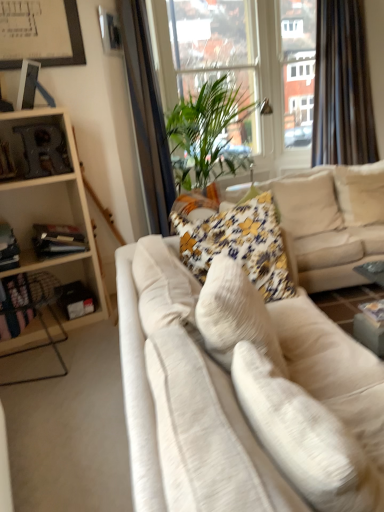
The width and height of the screenshot is (384, 512). I want to click on velvet beige couch at center, the second studio couch when ordered from front to back, so click(331, 222).

What do you see at coordinates (298, 69) in the screenshot?
I see `white plastic window frame at upper center` at bounding box center [298, 69].

Describe the element at coordinates (242, 393) in the screenshot. The height and width of the screenshot is (512, 384). I see `white fabric couch at center, the first studio couch viewed from the front` at that location.

The width and height of the screenshot is (384, 512). What are the coordinates of `transparent glass window screen at upper center` in the screenshot? It's located at (214, 44).

Describe the element at coordinates (342, 87) in the screenshot. I see `black velvet curtain at upper right` at that location.

Identify the location of green leafy plant at center. (211, 129).

Between floral fabric pillow at center, the 3th pillow in the front-to-back sequence, and velvet beige couch at center, the second studio couch when ordered from front to back, which one has more height?

velvet beige couch at center, the second studio couch when ordered from front to back.

Based on the photo, from a real-world perspective, which is physically below, floral fabric pillow at center, the 2th pillow when ordered from back to front, or velvet beige couch at center, the second studio couch when ordered from front to back?

velvet beige couch at center, the second studio couch when ordered from front to back, from a real-world perspective.

Is velvet beige couch at center, arranged as the first studio couch when viewed from the back, at the back of floral fabric pillow at center, the 3th pillow in the front-to-back sequence?

Yes, floral fabric pillow at center, the 3th pillow in the front-to-back sequence, is positioned with its back facing velvet beige couch at center, arranged as the first studio couch when viewed from the back.

Is floral fabric pillow at center, the 3th pillow in the front-to-back sequence, spatially inside velvet beige couch at center, arranged as the first studio couch when viewed from the back, or outside of it?

floral fabric pillow at center, the 3th pillow in the front-to-back sequence, is contained in velvet beige couch at center, arranged as the first studio couch when viewed from the back.

Would you say transparent glass window screen at upper center is part of white plastic window frame at upper center's contents?

No, transparent glass window screen at upper center is located outside of white plastic window frame at upper center.

Is point (301, 21) closer to viewer compared to point (243, 143)?

No, it is behind (243, 143).

Can you tell me how much white plastic window frame at upper center and transparent glass window screen at upper center differ in facing direction?

The facing directions of white plastic window frame at upper center and transparent glass window screen at upper center are 50.4 degrees apart.

Can you confirm if white plastic window frame at upper center is smaller than transparent glass window screen at upper center?

Yes, white plastic window frame at upper center is smaller than transparent glass window screen at upper center.

Is point (350, 508) behind point (236, 313)?

No, it is not.

From a real-world perspective, is white fabric pillow at center, which appears as the first pillow when viewed from the front, above or below white fabric couch at center, placed as the second studio couch when sorted from back to front?

white fabric pillow at center, which appears as the first pillow when viewed from the front, is above white fabric couch at center, placed as the second studio couch when sorted from back to front.

From the image's perspective, between white fabric pillow at center, which appears as the first pillow when viewed from the front, and white fabric couch at center, the first studio couch viewed from the front, which one is located above?

white fabric couch at center, the first studio couch viewed from the front, is shown above in the image.

Are white fabric pillow at center, which appears as the first pillow when viewed from the front, and white fabric couch at center, the first studio couch viewed from the front, making contact?

No.

Is floral fabric pillow at center, which is the 2th pillow from front to back, located within white plastic window frame at upper center?

No, floral fabric pillow at center, which is the 2th pillow from front to back, is located outside of white plastic window frame at upper center.

Who is more distant, white plastic window frame at upper center or floral fabric pillow at center, which is the 2th pillow from front to back?

white plastic window frame at upper center is further away from the camera.

Which is more to the right, white plastic window frame at upper center or floral fabric pillow at center, which is the 2th pillow from front to back?

Positioned to the right is white plastic window frame at upper center.

Could you tell me if floral fabric pillow at center, the 3th pillow in the front-to-back sequence, is facing transparent glass window screen at upper center?

No, floral fabric pillow at center, the 3th pillow in the front-to-back sequence, is not oriented towards transparent glass window screen at upper center.

From the image's perspective, would you say floral fabric pillow at center, the 2th pillow when ordered from back to front, is shown under transparent glass window screen at upper center?

Yes, from the image's perspective, floral fabric pillow at center, the 2th pillow when ordered from back to front, is beneath transparent glass window screen at upper center.

Between point (326, 209) and point (206, 77), which one is positioned in front?

The point (326, 209) is more forward.

Is floral fabric pillow at center, the 2th pillow when ordered from back to front, completely or partially outside of transparent glass window screen at upper center?

Yes.

Which is in front, point (43, 320) or point (281, 395)?

The point (281, 395) is closer.

This screenshot has height=512, width=384. I want to click on chair below the white fabric pillow at center, arranged as the 4th pillow when viewed from the back (from a real-world perspective), so click(x=40, y=315).

Considering the relative positions of wooden bookshelf at left and white fabric pillow at center, which appears as the first pillow when viewed from the front, in the image provided, is wooden bookshelf at left to the left of white fabric pillow at center, which appears as the first pillow when viewed from the front, from the viewer's perspective?

Yes.

Between green leafy plant at center and white fabric pillow at center, arranged as the 4th pillow when viewed from the back, which one appears on the right side from the viewer's perspective?

white fabric pillow at center, arranged as the 4th pillow when viewed from the back, is more to the right.

Looking at this image, how many degrees apart are the facing directions of green leafy plant at center and white fabric pillow at center, arranged as the 4th pillow when viewed from the back?

The angular difference between green leafy plant at center and white fabric pillow at center, arranged as the 4th pillow when viewed from the back, is 79.5 degrees.

Is the position of green leafy plant at center more distant than that of white fabric pillow at center, arranged as the 4th pillow when viewed from the back?

Yes, green leafy plant at center is further from the camera.

Is white fabric pillow at center, which appears as the first pillow when viewed from the front, completely or partially inside green leafy plant at center?

Actually, white fabric pillow at center, which appears as the first pillow when viewed from the front, is outside green leafy plant at center.

Which pillow is the 1st one when counting from the back of the velvet beige couch at center, arranged as the first studio couch when viewed from the back? Please provide its 2D coordinates.

[(307, 204)]

What are the coordinates of `window screen in front of the white plastic window frame at upper center` in the screenshot? It's located at (214, 44).

Based on the photo, considering their positions, is velvet beige couch at center, the second studio couch when ordered from front to back, positioned further to green leafy plant at center than wooden bookshelf at left?

Among the two, wooden bookshelf at left is located further to green leafy plant at center.

When comparing their distances from white fabric pillow at upper right, positioned as the fourth pillow in front-to-back order, does white fabric couch at center, placed as the second studio couch when sorted from back to front, or transparent glass window screen at upper center seem closer?

white fabric couch at center, placed as the second studio couch when sorted from back to front, lies closer to white fabric pillow at upper right, positioned as the fourth pillow in front-to-back order, than the other object.

Consider the image. Which object lies further to the anchor point wooden bookshelf at left, wooden shelf at left or velvet beige couch at center, the second studio couch when ordered from front to back?

velvet beige couch at center, the second studio couch when ordered from front to back, is further to wooden bookshelf at left.

Considering their positions, is floral fabric pillow at center, which is the 2th pillow from front to back, positioned closer to white fabric pillow at center, which appears as the first pillow when viewed from the front, than transparent glass window screen at upper center?

floral fabric pillow at center, which is the 2th pillow from front to back, is closer to white fabric pillow at center, which appears as the first pillow when viewed from the front.

When comparing their distances from white fabric pillow at center, arranged as the 4th pillow when viewed from the back, does wooden bookshelf at left or floral fabric pillow at center, the 3th pillow viewed from the back, seem further?

wooden bookshelf at left is further to white fabric pillow at center, arranged as the 4th pillow when viewed from the back.

From the image, which object appears to be farther from wooden shelf at left, white plastic window frame at upper center or white fabric pillow at upper right, positioned as the fourth pillow in front-to-back order?

The object further to wooden shelf at left is white plastic window frame at upper center.

Looking at the image, which one is located further to white fabric pillow at upper right, positioned as the fourth pillow in front-to-back order, black velvet curtain at upper right or transparent glass window screen at upper center?

transparent glass window screen at upper center.

Looking at the image, which one is located closer to white fabric pillow at upper right, positioned as the fourth pillow in front-to-back order, floral fabric pillow at center, which is the 2th pillow from front to back, or transparent glass window screen at upper center?

floral fabric pillow at center, which is the 2th pillow from front to back, is positioned closer to the anchor white fabric pillow at upper right, positioned as the fourth pillow in front-to-back order.

The image size is (384, 512). In order to click on window screen between white plastic window frame at upper center and floral fabric pillow at center, the 2th pillow when ordered from back to front, in the up-down direction in this screenshot , I will do `click(214, 44)`.

Locate an element on the screen. This screenshot has height=512, width=384. houseplant positioned between white fabric couch at center, placed as the second studio couch when sorted from back to front, and white plastic window frame at upper center from near to far is located at coordinates (211, 129).

The width and height of the screenshot is (384, 512). Find the location of `studio couch between white fabric couch at center, the first studio couch viewed from the front, and white plastic window frame at upper center, along the z-axis`. studio couch between white fabric couch at center, the first studio couch viewed from the front, and white plastic window frame at upper center, along the z-axis is located at coordinates (331, 222).

At what (x,y) coordinates should I click in order to perform the action: click on houseplant between wooden shelf at left and white fabric pillow at upper right, the 1th pillow from the back, in the horizontal direction. Please return your answer as a coordinate pair (x, y). Looking at the image, I should click on (211, 129).